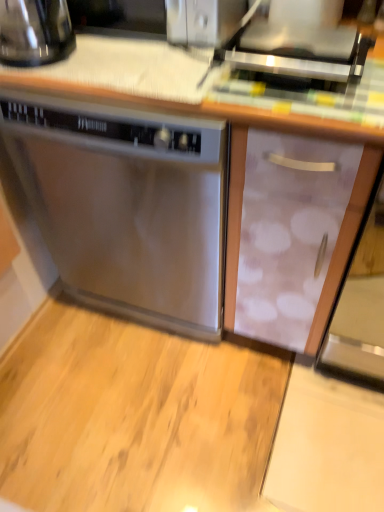
Identify the location of stainless steel dishwasher at center. The height and width of the screenshot is (512, 384). (127, 205).

Describe the element at coordinates (35, 32) in the screenshot. I see `shiny black kettle at upper left` at that location.

At what (x,y) coordinates should I click in order to perform the action: click on stainless steel dishwasher at center. Please return your answer as a coordinate pair (x, y). Looking at the image, I should click on (127, 205).

In terms of height, does satin silver toaster at upper center look taller or shorter compared to shiny black kettle at upper left?

Considering their sizes, satin silver toaster at upper center has less height than shiny black kettle at upper left.

Which object is further away from the camera taking this photo, satin silver toaster at upper center or shiny black kettle at upper left?

shiny black kettle at upper left.

Considering the relative sizes of satin silver toaster at upper center and shiny black kettle at upper left in the image provided, is satin silver toaster at upper center smaller than shiny black kettle at upper left?

Indeed, satin silver toaster at upper center has a smaller size compared to shiny black kettle at upper left.

Looking at this image, considering the sizes of objects satin silver toaster at upper center and stainless steel dishwasher at center in the image provided, who is taller, satin silver toaster at upper center or stainless steel dishwasher at center?

Standing taller between the two is stainless steel dishwasher at center.

Which of these two, satin silver toaster at upper center or stainless steel dishwasher at center, is bigger?

With larger size is stainless steel dishwasher at center.

Which is closer to the camera, (60, 41) or (4, 112)?

The point (60, 41) is in front.

Considering the positions of objects shiny black kettle at upper left and stainless steel dishwasher at center in the image provided, who is more to the right, shiny black kettle at upper left or stainless steel dishwasher at center?

From the viewer's perspective, stainless steel dishwasher at center appears more on the right side.

Where is `kitchen appliance that appears above the stainless steel dishwasher at center (from a real-world perspective)`? kitchen appliance that appears above the stainless steel dishwasher at center (from a real-world perspective) is located at coordinates (35, 32).

Is shiny black kettle at upper left in contact with stainless steel dishwasher at center?

No.

Is stainless steel dishwasher at center in contact with shiny black kettle at upper left?

No.

Could you tell me if stainless steel dishwasher at center is turned towards shiny black kettle at upper left?

No, stainless steel dishwasher at center does not turn towards shiny black kettle at upper left.

Which object is positioned more to the left, stainless steel dishwasher at center or shiny black kettle at upper left?

shiny black kettle at upper left is more to the left.

Is shiny black kettle at upper left to the right of satin silver toaster at upper center from the viewer's perspective?

In fact, shiny black kettle at upper left is to the left of satin silver toaster at upper center.

Which point is more distant from viewer, [0,51] or [334,78]?

Point [0,51]

This screenshot has height=512, width=384. In the image, there is a shiny black kettle at upper left. Find the location of `appliance below it (from the image's perspective)`. appliance below it (from the image's perspective) is located at coordinates (297, 53).

In the scene shown: Is shiny black kettle at upper left situated inside satin silver toaster at upper center or outside?

shiny black kettle at upper left lies outside satin silver toaster at upper center.

Is stainless steel dishwasher at center turned away from satin silver toaster at upper center?

No, satin silver toaster at upper center is not at the back of stainless steel dishwasher at center.

Is there a large distance between stainless steel dishwasher at center and satin silver toaster at upper center?

No, stainless steel dishwasher at center is not far from satin silver toaster at upper center.

In the scene shown: Measure the distance from stainless steel dishwasher at center to satin silver toaster at upper center.

stainless steel dishwasher at center is 16.35 inches from satin silver toaster at upper center.

Is satin silver toaster at upper center completely or partially inside stainless steel dishwasher at center?

No.

Find the location of `kitchen appliance that is above the satin silver toaster at upper center (from the image's perspective)`. kitchen appliance that is above the satin silver toaster at upper center (from the image's perspective) is located at coordinates (35, 32).

Identify the location of home appliance that appears on the left of satin silver toaster at upper center. The width and height of the screenshot is (384, 512). (127, 205).

Estimate the real-world distances between objects in this image. Which object is further from shiny black kettle at upper left, stainless steel dishwasher at center or satin silver toaster at upper center?

The object further to shiny black kettle at upper left is satin silver toaster at upper center.

When comparing their distances from stainless steel dishwasher at center, does satin silver toaster at upper center or shiny black kettle at upper left seem closer?

The object closer to stainless steel dishwasher at center is shiny black kettle at upper left.

Based on their spatial positions, is shiny black kettle at upper left or stainless steel dishwasher at center closer to satin silver toaster at upper center?

The object closer to satin silver toaster at upper center is stainless steel dishwasher at center.

Estimate the real-world distances between objects in this image. Which object is closer to satin silver toaster at upper center, stainless steel dishwasher at center or shiny black kettle at upper left?

stainless steel dishwasher at center.

Which object lies further to the anchor point shiny black kettle at upper left, satin silver toaster at upper center or stainless steel dishwasher at center?

satin silver toaster at upper center is further to shiny black kettle at upper left.

Looking at the image, which one is located closer to stainless steel dishwasher at center, shiny black kettle at upper left or satin silver toaster at upper center?

shiny black kettle at upper left is positioned closer to the anchor stainless steel dishwasher at center.

The image size is (384, 512). I want to click on home appliance between shiny black kettle at upper left and satin silver toaster at upper center from left to right, so pos(127,205).